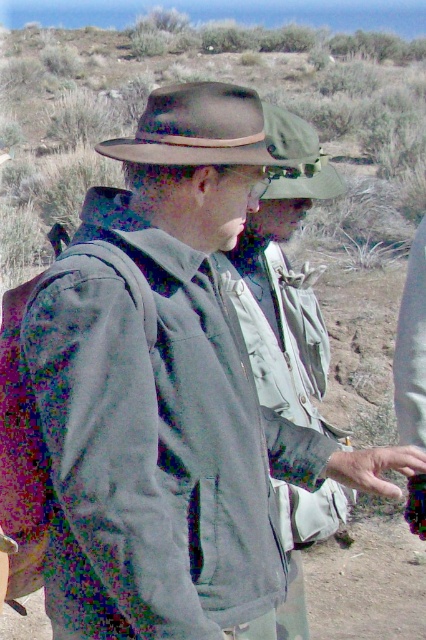
You are standing in the desert and see two hats in the scene. Which one is positioned to the left of the other? The matte brown cowboy hat at center or the green fabric cowboy hat at upper center?

The matte brown cowboy hat at center is positioned to the left of the green fabric cowboy hat at upper center.

You are a photographer trying to capture both the gray matte jacket at center and the green matte jacket at center in a single frame. Given that your camera has a minimum focus distance of 6 inches, will you be able to focus on both jackets simultaneously?

The distance between the gray matte jacket at center and green matte jacket at center is 6.71 inches, which is greater than the camera minimum focus distance of 6 inches. Therefore, the photographer can focus on both jackets simultaneously.